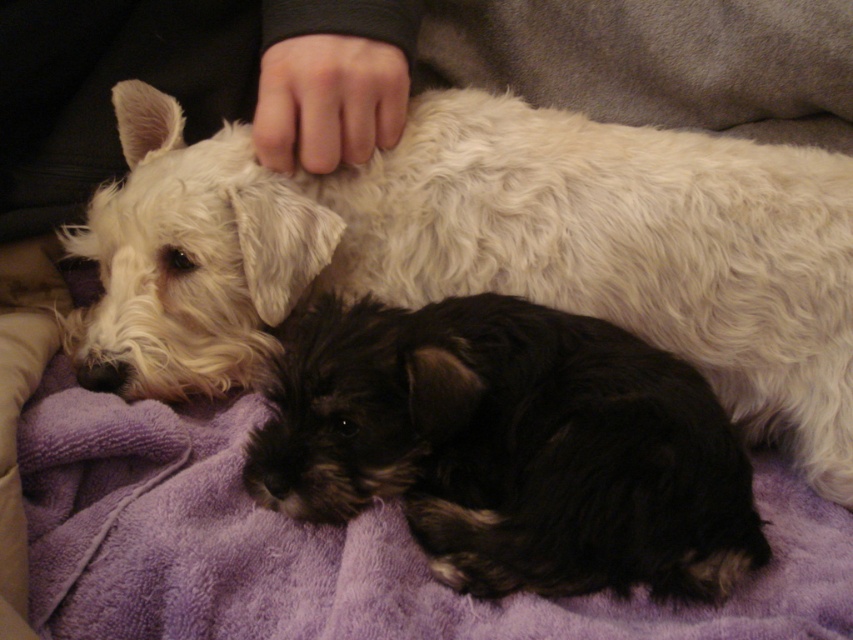
You are a photographer trying to capture a closeup of the white fluffy dog at upper left. The photographer wants to ensure that the point at coordinates point (486,250) is within the frame. Can you confirm if the point is on the white fluffy dog at upper left?

The point (486,250) is on the white fluffy dog at upper left, so yes, the point is correctly positioned on the dog.